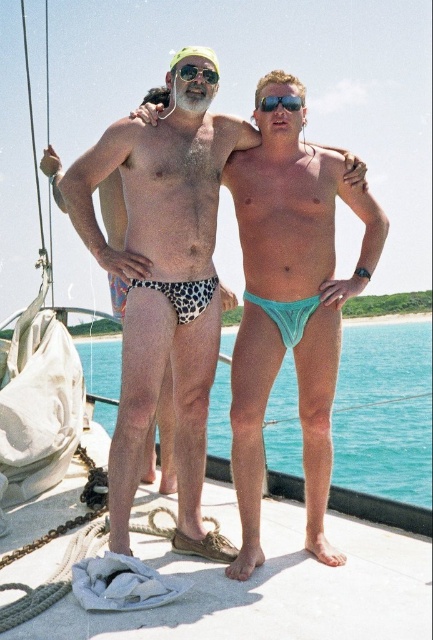
Is point (272, 104) farther from viewer compared to point (193, 77)?

That is True.

At what (x,y) coordinates should I click in order to perform the action: click on sunglasses at center. Please return your answer as a coordinate pair (x, y). Looking at the image, I should click on (280, 102).

Which is below, teal fabric thong at center or green plastic goggles at upper center?

Positioned lower is teal fabric thong at center.

Can you confirm if teal fabric thong at center is positioned below green plastic goggles at upper center?

Yes.

At what (x,y) coordinates should I click in order to perform the action: click on teal fabric thong at center. Please return your answer as a coordinate pair (x, y). Looking at the image, I should click on (290, 305).

Locate an element on the screen. The height and width of the screenshot is (640, 433). teal fabric thong at center is located at coordinates (290, 305).

What do you see at coordinates (164, 282) in the screenshot?
I see `leopard print swim trunks at center` at bounding box center [164, 282].

Where is `leopard print swim trunks at center`? The height and width of the screenshot is (640, 433). leopard print swim trunks at center is located at coordinates (164, 282).